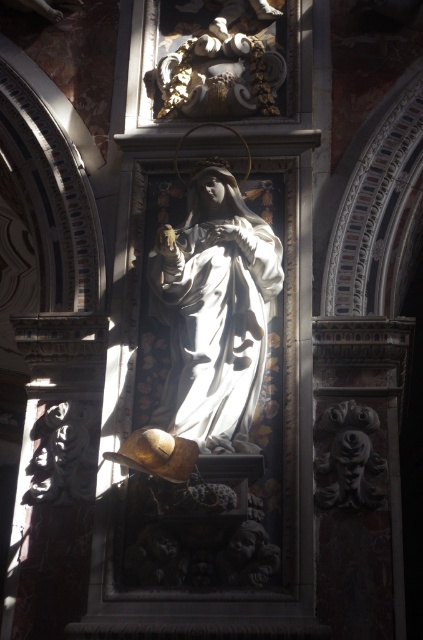
You are standing in the cathedral and want to determine the spatial relationship between two points marked in the scene. Which point, point (x=208, y=401) or point (x=280, y=77), is closer to you?

Point (x=208, y=401) is closer to the viewer than point (x=280, y=77).

You are an art conservator tasked with measuring the space between two statues in a cathedral. You need to ensure a 10 meter safety distance between them for preservation purposes. Are the matte white statue at center and the gold textured statue at upper center within the required distance?

The distance between the matte white statue at center and the gold textured statue at upper center is 11.27 meters, which exceeds the required 10 meter safety distance. Therefore, they are within the preservation guidelines.

You are standing in a cathedral and see a statue at the center. There is a point at coordinates (214, 310). Where exactly is this point located?

The point at coordinates (214, 310) is located on the matte white statue at center.